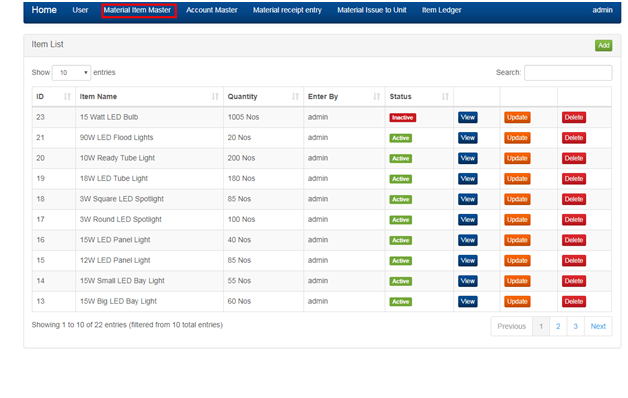
At what (x,y) coordinates should I click in order to perform the action: click on types of lights. Please return your answer as a coordinate pair (x, y). The width and height of the screenshot is (628, 398). Looking at the image, I should click on (102, 116), (100, 139), (102, 157), (103, 175), (102, 204), (105, 217), (104, 239), (103, 266), (103, 286), (105, 300).